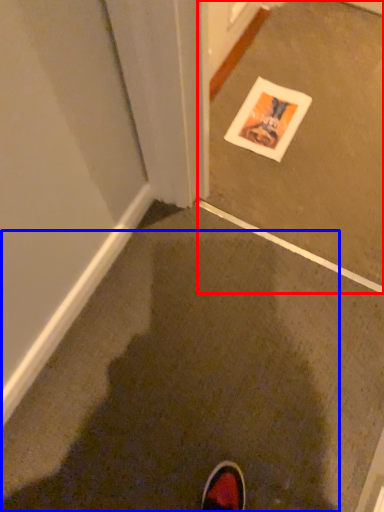
Question: Which of the following is the closest to the observer, concrete (highlighted by a red box) or mud (highlighted by a blue box)?

Choices:
 (A) concrete
 (B) mud

Answer: (B)